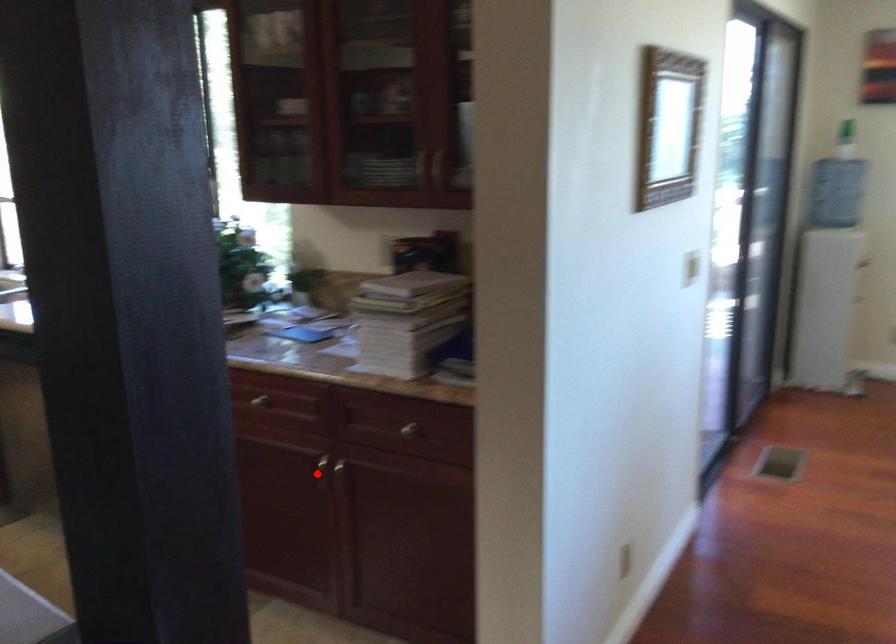
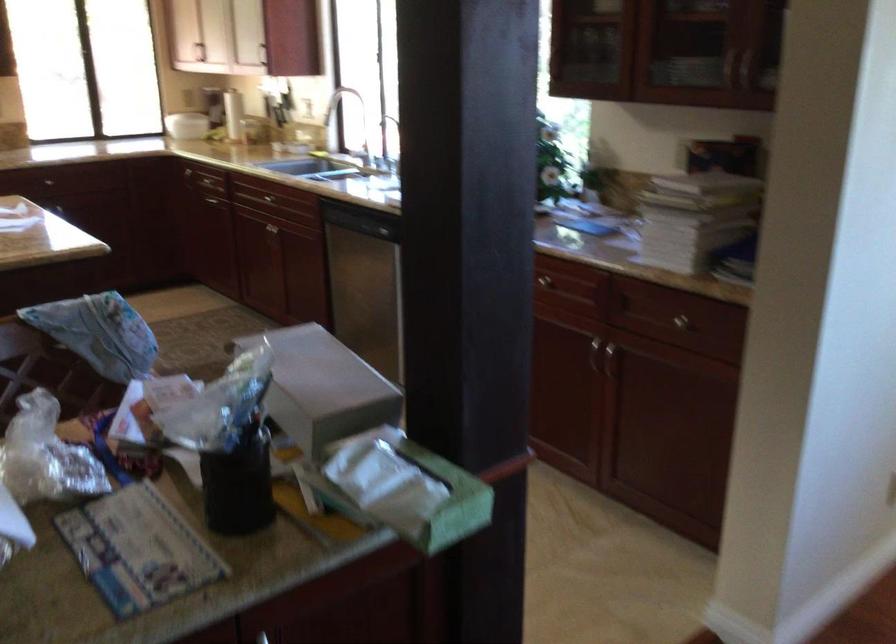
In the second image, find the point that corresponds to the highlighted location in the first image.

(593, 355)